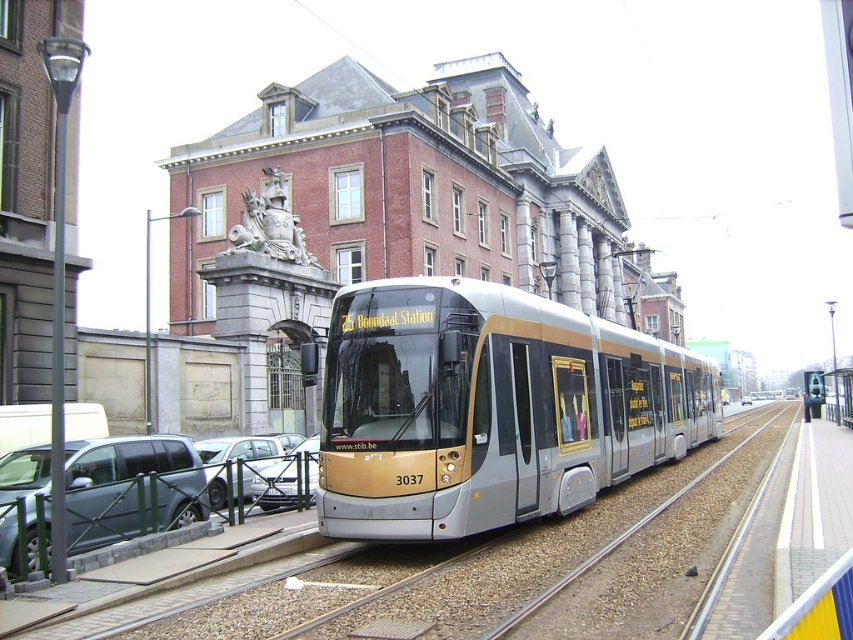
Question: Among these objects, which one is farthest from the camera?

Choices:
 (A) metallic gray suv at lower left
 (B) gold metallic tram at center
 (C) metallic silver car at center

Answer: (C)

Question: Which object appears closest to the camera in this image?

Choices:
 (A) metallic silver car at center
 (B) gold metallic tram at center
 (C) silver metallic car at lower left
 (D) metallic gray suv at lower left

Answer: (B)

Question: Which of these objects is positioned closest to the silver metallic car at lower left?

Choices:
 (A) metallic gray suv at lower left
 (B) gold metallic tram at center
 (C) metallic silver car at center

Answer: (A)

Question: Is metallic gray suv at lower left further to the viewer compared to metallic silver car at center?

Choices:
 (A) yes
 (B) no

Answer: (B)

Question: Does gold metallic tram at center appear on the left side of metallic silver car at center?

Choices:
 (A) yes
 (B) no

Answer: (B)

Question: Is the position of gold metallic tram at center less distant than that of metallic gray suv at lower left?

Choices:
 (A) yes
 (B) no

Answer: (A)